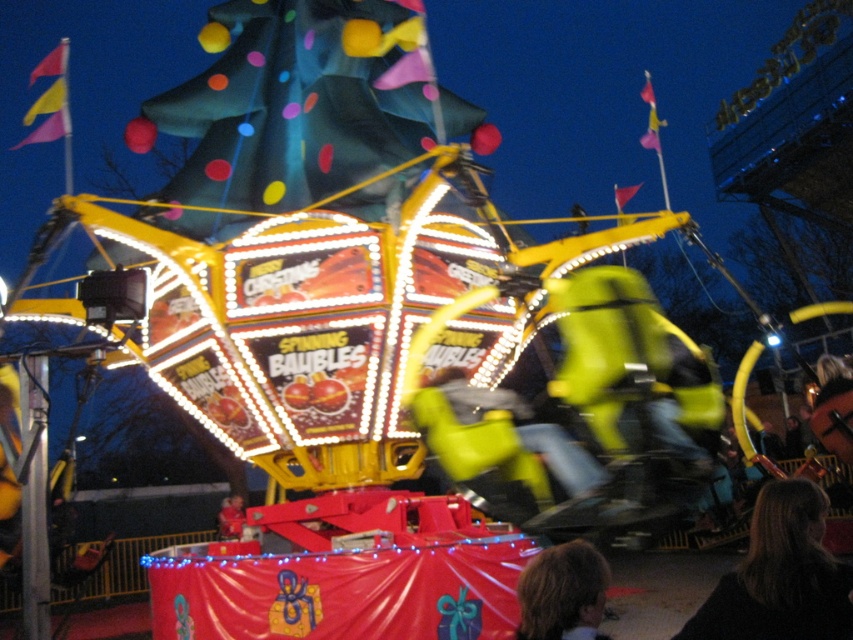
Is dark brown hair at lower right wider than brown hair at lower center?

Yes, dark brown hair at lower right is wider than brown hair at lower center.

At what (x,y) coordinates should I click in order to perform the action: click on dark brown hair at lower right. Please return your answer as a coordinate pair (x, y). This screenshot has width=853, height=640. Looking at the image, I should click on (780, 576).

This screenshot has width=853, height=640. In order to click on dark brown hair at lower right in this screenshot , I will do `click(780, 576)`.

Does brown hair at lower center come behind smooth red shirt at lower center?

No, brown hair at lower center is closer to the viewer.

Can you confirm if brown hair at lower center is taller than smooth red shirt at lower center?

No.

The height and width of the screenshot is (640, 853). Describe the element at coordinates (561, 592) in the screenshot. I see `brown hair at lower center` at that location.

This screenshot has height=640, width=853. What are the coordinates of `brown hair at lower center` in the screenshot? It's located at (561, 592).

Is dark brown hair at lower right above smooth red shirt at lower center?

Correct, dark brown hair at lower right is located above smooth red shirt at lower center.

At what (x,y) coordinates should I click in order to perform the action: click on dark brown hair at lower right. Please return your answer as a coordinate pair (x, y). This screenshot has width=853, height=640. Looking at the image, I should click on (780, 576).

This screenshot has width=853, height=640. What do you see at coordinates (780, 576) in the screenshot?
I see `dark brown hair at lower right` at bounding box center [780, 576].

This screenshot has height=640, width=853. I want to click on dark brown hair at lower right, so click(780, 576).